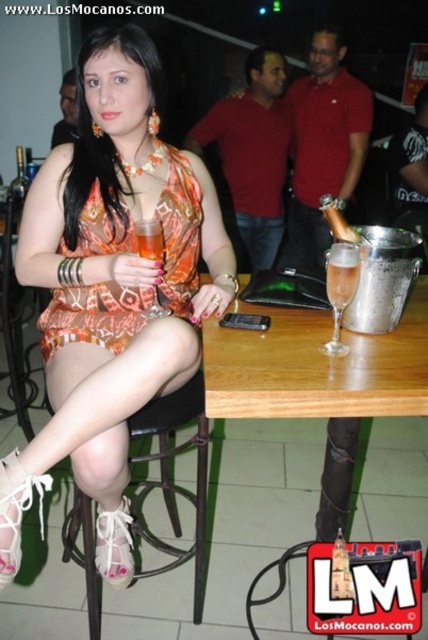
You are a photographer trying to capture a candid shot of the orange printed fabric dress at center and the black leather bar stool at lower left. Since you want to ensure both are in focus, you need to know their heights. Can you confirm which one is taller?

The orange printed fabric dress at center is not as tall as the black leather bar stool at lower left, so the black leather bar stool at lower left is taller.

You are a photographer trying to capture the scene from the front. The orange printed fabric dress at center and the black leather bar stool at lower left are both in your frame. Which object appears narrower in the photo?

The orange printed fabric dress at center appears narrower in the photo because it has a lesser width compared to the black leather bar stool at lower left.